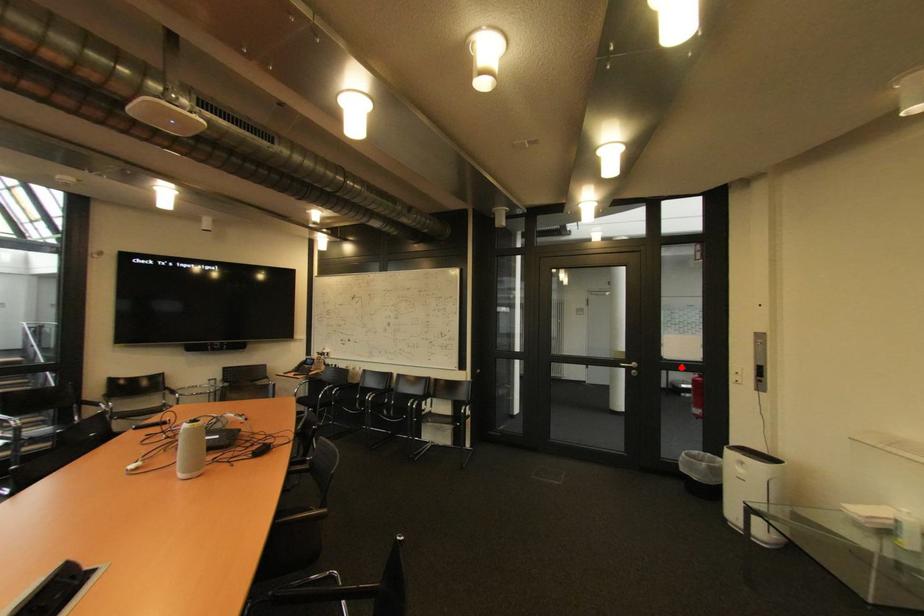
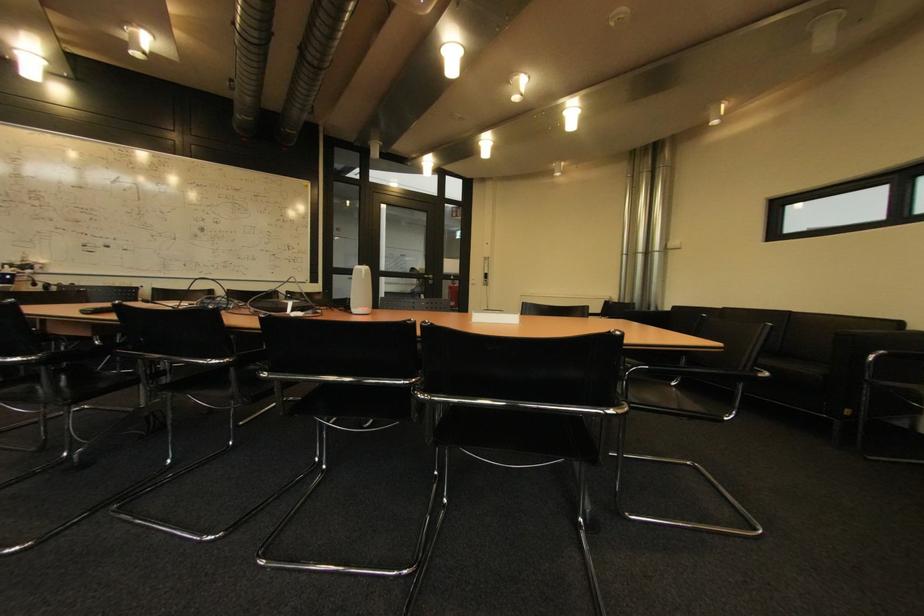
Question: I am providing you with two images of the same scene from different viewpoints. Image1 has a red point marked. In image2, the corresponding 3D location appears at what relative position? Reply with the corresponding letter.

Choices:
 (A) Closer
 (B) Farther

Answer: (A)